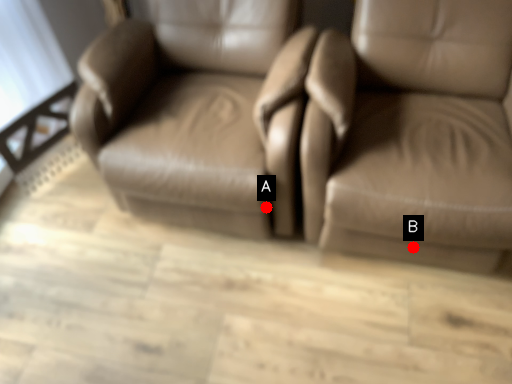
Question: Two points are circled on the image, labeled by A and B beside each circle. Which point is farther to the camera?

Choices:
 (A) A is further
 (B) B is further

Answer: (A)